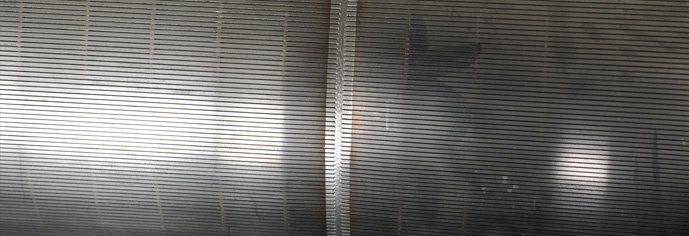
Image resolution: width=689 pixels, height=236 pixels. In order to click on vertical string holding up venetian blinds in this screenshot , I will do click(152, 36).